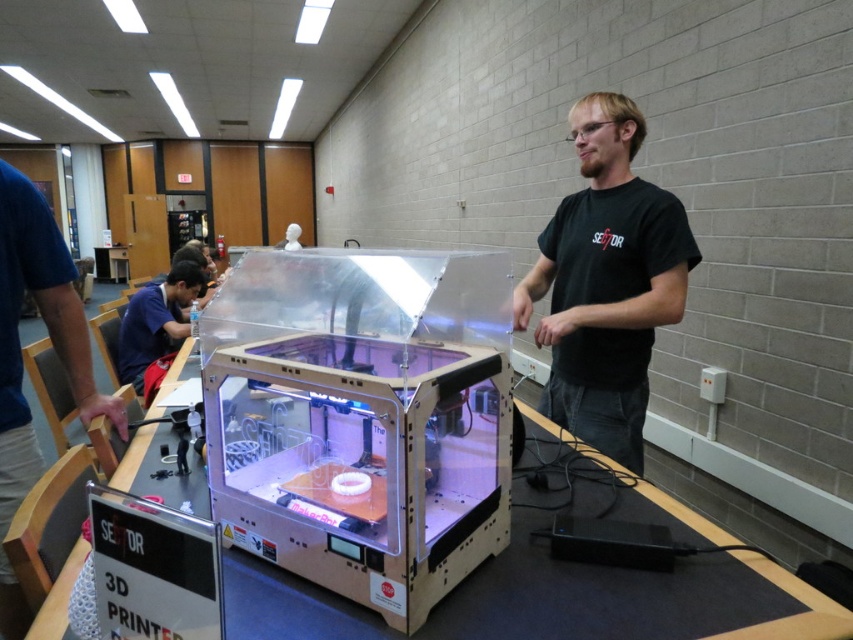
You are looking at the scene and notice two shirts in the image. The black matte shirt at center and the blue fabric shirt at left. Which shirt is positioned higher in the image?

The black matte shirt at center is positioned higher than the blue fabric shirt at left in the image.

You are standing in front of the 3D printer in the workshop. There is a point marked at coordinates point (13, 269). If you want to place a tool that requires 1.5 meters of space between you and the point, will you be able to do so?

The distance of point (13, 269) from the viewer is 1.45 meters, so placing a tool that requires 1.5 meters of space would not be possible as the available distance is slightly less.

You are standing in the workshop and see the black matte shirt at center and the matte blue shirt at left. Which shirt is closer to you?

The black matte shirt at center is closer to you because it is in front of the matte blue shirt at left.